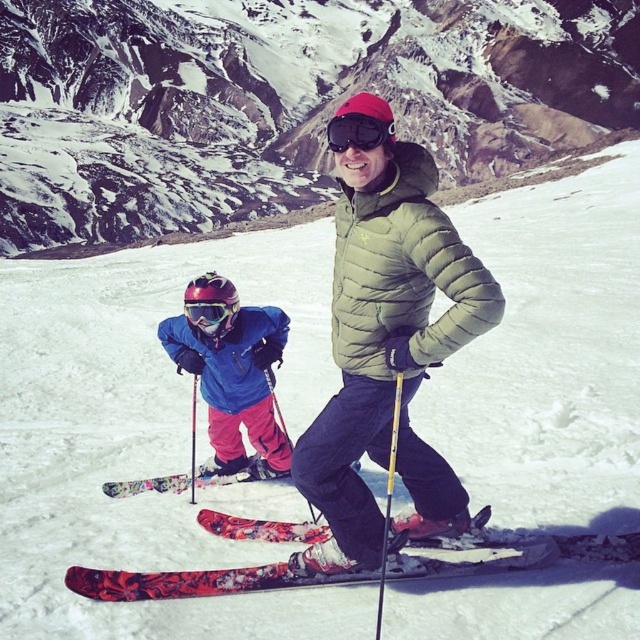
Question: Is green quilted jacket at center above matte black goggles at center?

Choices:
 (A) yes
 (B) no

Answer: (B)

Question: Can you confirm if blue matte ski jacket at lower left is thinner than black matte goggles at center?

Choices:
 (A) no
 (B) yes

Answer: (A)

Question: Which object is the farthest from the snowy granite mountain at upper center?

Choices:
 (A) floral-patterned skis at lower center
 (B) blue matte ski jacket at lower left
 (C) matte black goggles at center

Answer: (A)

Question: Considering the real-world distances, which object is closest to the green quilted jacket at center?

Choices:
 (A) blue matte ski jacket at lower left
 (B) floral-patterned skis at lower center

Answer: (A)

Question: Which point is closer to the camera?

Choices:
 (A) floral-patterned skis at center
 (B) green quilted jacket at center

Answer: (B)

Question: Is snowy granite mountain at upper center smaller than black matte goggles at center?

Choices:
 (A) no
 (B) yes

Answer: (A)